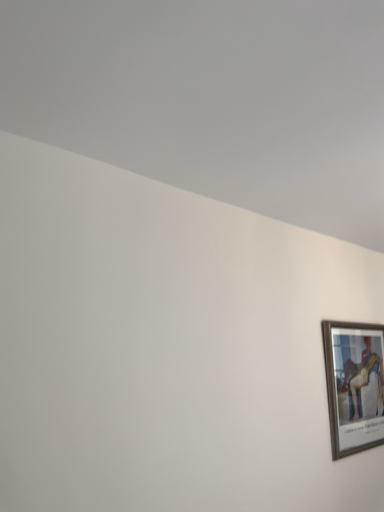
Question: Should I look upward or downward to see wooden picture frame at lower right?

Choices:
 (A) up
 (B) down

Answer: (B)